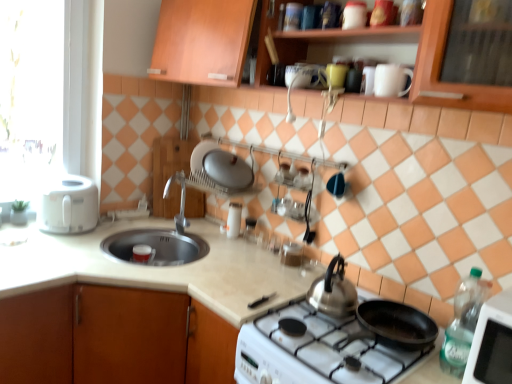
Locate an element on the screen. This screenshot has width=512, height=384. vacant region in front of white plastic toaster at left, positioned as the 1th kitchen appliance in back-to-front order is located at coordinates click(x=41, y=244).